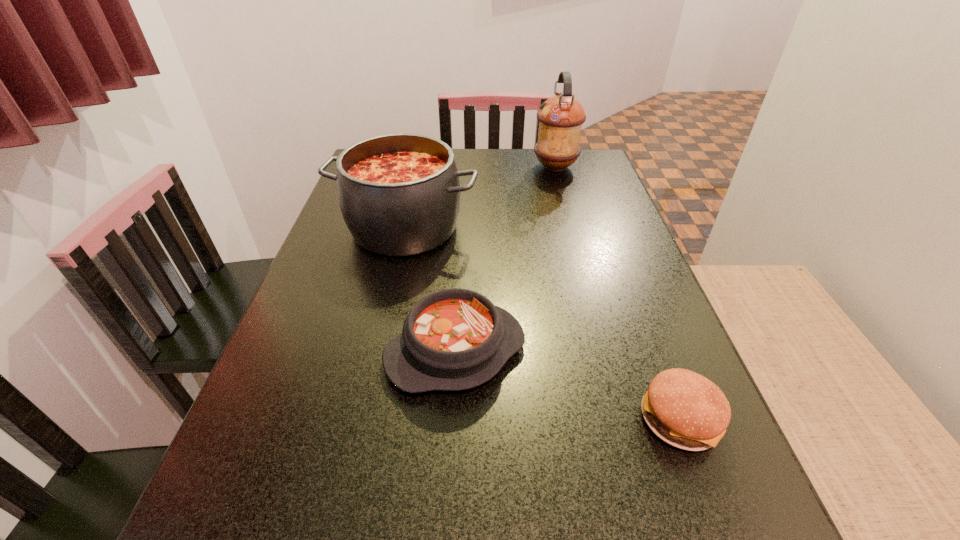
Identify which object is the second closest to the farther casserole. Please provide its 2D coordinates. Your answer should be formatted as a tuple, i.e. [(x, y)], where the tuple contains the x and y coordinates of a point satisfying the conditions above.

[(560, 118)]

At what (x,y) coordinates should I click in order to perform the action: click on vacant area in the image that satisfies the following two spatial constraints: 1. on the front side of the shorter casserole; 2. on the left side of the second tallest object. Please return your answer as a coordinate pair (x, y). The height and width of the screenshot is (540, 960). Looking at the image, I should click on (377, 352).